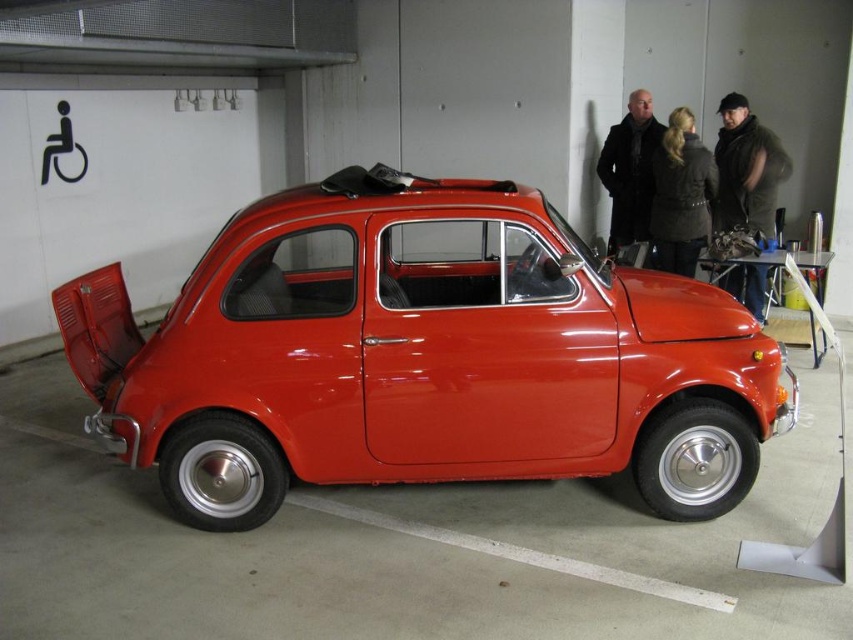
Question: Is glossy red car at center wider than black wool coat at upper right?

Choices:
 (A) yes
 (B) no

Answer: (A)

Question: Estimate the real-world distances between objects in this image. Which object is farther from the black wool coat at upper right?

Choices:
 (A) glossy red car at center
 (B) dark brown leather jacket at center

Answer: (A)

Question: Which object is the farthest from the dark brown leather jacket at center?

Choices:
 (A) black wool coat at upper right
 (B) dark brown leather jacket at upper right

Answer: (A)

Question: Can you confirm if glossy red car at center is positioned below dark brown leather jacket at center?

Choices:
 (A) yes
 (B) no

Answer: (A)

Question: Does glossy red car at center have a smaller size compared to black wool coat at upper right?

Choices:
 (A) yes
 (B) no

Answer: (B)

Question: Among these points, which one is farthest from the camera?

Choices:
 (A) (744, 145)
 (B) (660, 224)
 (C) (611, 250)

Answer: (C)